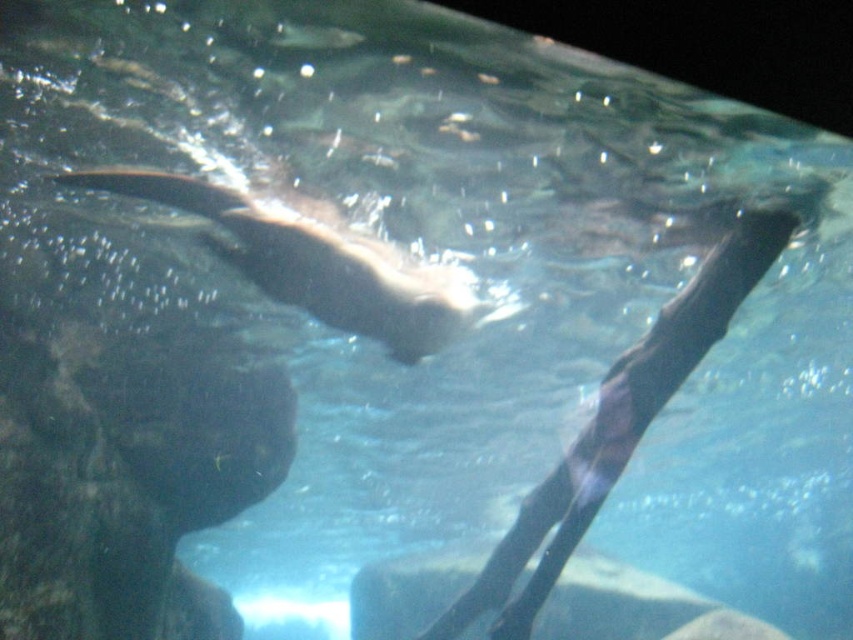
Question: Does smooth black seal at center appear under smooth gray rock at center?

Choices:
 (A) no
 (B) yes

Answer: (A)

Question: Based on their relative distances, which object is farther from the shiny brown otter at center?

Choices:
 (A) smooth black seal at center
 (B) smooth gray rock at center

Answer: (B)

Question: Can you confirm if smooth black seal at center is positioned above shiny brown otter at center?

Choices:
 (A) no
 (B) yes

Answer: (A)

Question: Which point is farther to the camera?

Choices:
 (A) (235, 196)
 (B) (569, 470)
 (C) (625, 577)

Answer: (C)

Question: Is shiny brown otter at center below smooth gray rock at center?

Choices:
 (A) no
 (B) yes

Answer: (A)

Question: Which of the following is the farthest from the observer?

Choices:
 (A) shiny brown otter at center
 (B) smooth black seal at center

Answer: (B)